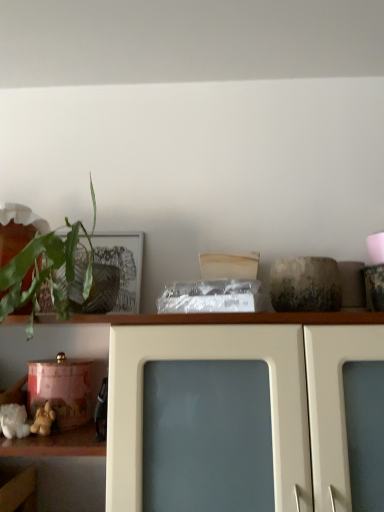
Measure the distance between point (x=42, y=428) and camera.

A distance of 93.90 centimeters exists between point (x=42, y=428) and camera.

The width and height of the screenshot is (384, 512). What are the coordinates of `green leafy plant at left` in the screenshot? It's located at (52, 275).

You are a GUI agent. You are given a task and a screenshot of the screen. Output one action in this format:
    pyautogui.click(x=<x>, y=<y>)
    Task: Click on the soft yellow plush toy at lower left
    This screenshot has height=512, width=384.
    Given the screenshot: What is the action you would take?
    pyautogui.click(x=43, y=420)

Is soft yellow plush toy at lower left inside white glossy cabinet at upper center?

Yes, soft yellow plush toy at lower left can be found within white glossy cabinet at upper center.

Between white glossy cabinet at upper center and soft yellow plush toy at lower left, which one has smaller size?

With smaller size is soft yellow plush toy at lower left.

In the image, there is a white glossy cabinet at upper center. Where is `stuff above it (from the image's perspective)`? The height and width of the screenshot is (512, 384). stuff above it (from the image's perspective) is located at coordinates (43, 420).

Which of these two, white glossy cabinet at upper center or soft yellow plush toy at lower left, stands taller?

white glossy cabinet at upper center is taller.

Considering the sizes of soft yellow plush toy at lower left and white glossy cabinet at upper center in the image, is soft yellow plush toy at lower left taller or shorter than white glossy cabinet at upper center?

Clearly, soft yellow plush toy at lower left is shorter compared to white glossy cabinet at upper center.

Is soft yellow plush toy at lower left not close to white glossy cabinet at upper center?

That's not correct — soft yellow plush toy at lower left is a little close to white glossy cabinet at upper center.

Is soft yellow plush toy at lower left looking in the opposite direction of white glossy cabinet at upper center?

That's right, soft yellow plush toy at lower left is facing away from white glossy cabinet at upper center.

Between soft yellow plush toy at lower left and white glossy cabinet at upper center, which one appears on the left side from the viewer's perspective?

From the viewer's perspective, soft yellow plush toy at lower left appears more on the left side.

Which of these two, green leafy plant at left or white glossy cabinet at upper center, is smaller?

With smaller size is green leafy plant at left.

Is white glossy cabinet at upper center at the back of green leafy plant at left?

No.

How many degrees apart are the facing directions of green leafy plant at left and white glossy cabinet at upper center?

1.44 degrees.

Does green leafy plant at left touch white glossy cabinet at upper center?

No, green leafy plant at left is not beside white glossy cabinet at upper center.

Can you confirm if white glossy cabinet at upper center is shorter than green leafy plant at left?

No.

Locate an element on the screen. This screenshot has width=384, height=512. shelf below the green leafy plant at left (from the image's perspective) is located at coordinates (142, 324).

Is green leafy plant at left a part of white glossy cabinet at upper center?

No, green leafy plant at left is located outside of white glossy cabinet at upper center.

Could you tell me if white glossy cabinet at upper center is facing green leafy plant at left?

No, white glossy cabinet at upper center is not turned towards green leafy plant at left.

In terms of height, does green leafy plant at left look taller or shorter compared to soft yellow plush toy at lower left?

green leafy plant at left is taller than soft yellow plush toy at lower left.

Is green leafy plant at left inside or outside of soft yellow plush toy at lower left?

green leafy plant at left exists outside the volume of soft yellow plush toy at lower left.

Which is more to the left, green leafy plant at left or soft yellow plush toy at lower left?

Positioned to the left is soft yellow plush toy at lower left.

From the picture: Is green leafy plant at left smaller than soft yellow plush toy at lower left?

Actually, green leafy plant at left might be larger than soft yellow plush toy at lower left.

Locate an element on the screen. Image resolution: width=384 pixels, height=512 pixels. houseplant above the soft yellow plush toy at lower left (from the image's perspective) is located at coordinates (52, 275).

Is soft yellow plush toy at lower left positioned in front of green leafy plant at left?

That is False.

From a real-world perspective, between soft yellow plush toy at lower left and green leafy plant at left, who is vertically higher?

green leafy plant at left.

Can you tell me how much soft yellow plush toy at lower left and green leafy plant at left differ in facing direction?

0.776 degrees.

The image size is (384, 512). Identify the location of shelf below the soft yellow plush toy at lower left (from the image's perspective). (142, 324).

The height and width of the screenshot is (512, 384). I want to click on stuff located above the white glossy cabinet at upper center (from the image's perspective), so click(x=43, y=420).

From the image, which object appears to be nearer to green leafy plant at left, white glossy cabinet at upper center or soft yellow plush toy at lower left?

The object closer to green leafy plant at left is white glossy cabinet at upper center.

Consider the image. When comparing their distances from soft yellow plush toy at lower left, does green leafy plant at left or white glossy cabinet at upper center seem closer?

green leafy plant at left lies closer to soft yellow plush toy at lower left than the other object.

Based on their spatial positions, is white glossy cabinet at upper center or green leafy plant at left closer to soft yellow plush toy at lower left?

green leafy plant at left is closer to soft yellow plush toy at lower left.

Looking at the image, which one is located closer to white glossy cabinet at upper center, green leafy plant at left or soft yellow plush toy at lower left?

green leafy plant at left is closer to white glossy cabinet at upper center.

Estimate the real-world distances between objects in this image. Which object is further from green leafy plant at left, soft yellow plush toy at lower left or white glossy cabinet at upper center?

soft yellow plush toy at lower left is further to green leafy plant at left.

Which object lies further to the anchor point white glossy cabinet at upper center, soft yellow plush toy at lower left or green leafy plant at left?

soft yellow plush toy at lower left is positioned further to the anchor white glossy cabinet at upper center.

The width and height of the screenshot is (384, 512). In order to click on stuff between green leafy plant at left and white glossy cabinet at upper center in the vertical direction in this screenshot , I will do `click(43, 420)`.